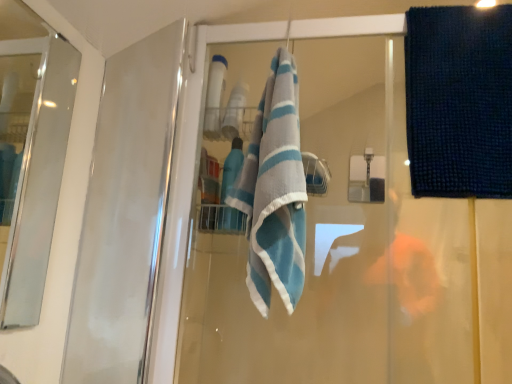
What do you see at coordinates (459, 101) in the screenshot? Image resolution: width=512 pixels, height=384 pixels. I see `dark blue textured towel at upper right` at bounding box center [459, 101].

This screenshot has height=384, width=512. Describe the element at coordinates (35, 164) in the screenshot. I see `clear glass screen door at left` at that location.

Where is `blue striped towel at center`? The width and height of the screenshot is (512, 384). blue striped towel at center is located at coordinates (275, 191).

What's the angular difference between blue striped towel at center and clear glass screen door at left's facing directions?

blue striped towel at center and clear glass screen door at left are facing 90.4 degrees away from each other.

Considering the positions of objects blue striped towel at center and clear glass screen door at left in the image provided, who is more to the right, blue striped towel at center or clear glass screen door at left?

blue striped towel at center is more to the right.

Based on the photo, is blue striped towel at center shorter than clear glass screen door at left?

Correct, blue striped towel at center is not as tall as clear glass screen door at left.

Between blue striped towel at center and dark blue textured towel at upper right, which one has smaller size?

dark blue textured towel at upper right.

Which object is positioned more to the right, blue striped towel at center or dark blue textured towel at upper right?

dark blue textured towel at upper right.

Can dark blue textured towel at upper right be found inside blue striped towel at center?

No, blue striped towel at center does not contain dark blue textured towel at upper right.

Considering the relative sizes of clear glass screen door at left and dark blue textured towel at upper right in the image provided, is clear glass screen door at left wider than dark blue textured towel at upper right?

In fact, clear glass screen door at left might be narrower than dark blue textured towel at upper right.

From a real-world perspective, which object rests below the other?

clear glass screen door at left.

How different are the orientations of clear glass screen door at left and dark blue textured towel at upper right in degrees?

90.4 degrees separate the facing orientations of clear glass screen door at left and dark blue textured towel at upper right.

Between point (42, 272) and point (455, 89), which one is positioned behind?

Positioned behind is point (42, 272).

From a real-world perspective, between dark blue textured towel at upper right and clear glass screen door at left, who is vertically lower?

In real-world perspective, clear glass screen door at left is lower.

Is dark blue textured towel at upper right facing towards clear glass screen door at left?

No, dark blue textured towel at upper right is not facing towards clear glass screen door at left.

Is dark blue textured towel at upper right spatially inside clear glass screen door at left, or outside of it?

dark blue textured towel at upper right is outside clear glass screen door at left.

Considering the positions of objects dark blue textured towel at upper right and clear glass screen door at left in the image provided, who is in front, dark blue textured towel at upper right or clear glass screen door at left?

clear glass screen door at left is closer to the camera.

Can you confirm if dark blue textured towel at upper right is thinner than blue striped towel at center?

Yes, dark blue textured towel at upper right is thinner than blue striped towel at center.

Is dark blue textured towel at upper right behind blue striped towel at center?

Yes, dark blue textured towel at upper right is behind blue striped towel at center.

Is dark blue textured towel at upper right oriented towards blue striped towel at center?

No.

Can you tell me how much clear glass screen door at left and blue striped towel at center differ in facing direction?

clear glass screen door at left and blue striped towel at center are facing 90.4 degrees away from each other.

Is blue striped towel at center at the back of clear glass screen door at left?

No, clear glass screen door at left is not facing the opposite direction of blue striped towel at center.

Would you say clear glass screen door at left is inside or outside blue striped towel at center?

clear glass screen door at left cannot be found inside blue striped towel at center.

From a real-world perspective, is clear glass screen door at left on blue striped towel at center?

Actually, clear glass screen door at left is physically below blue striped towel at center in the real world.

I want to click on towel on the right of clear glass screen door at left, so click(275, 191).

The height and width of the screenshot is (384, 512). Find the location of `towel on the left of the dark blue textured towel at upper right`. towel on the left of the dark blue textured towel at upper right is located at coordinates (275, 191).

From the image, which object appears to be nearer to clear glass screen door at left, dark blue textured towel at upper right or blue striped towel at center?

blue striped towel at center.

Considering their positions, is dark blue textured towel at upper right positioned further to blue striped towel at center than clear glass screen door at left?

Among the two, clear glass screen door at left is located further to blue striped towel at center.

Which object lies further to the anchor point dark blue textured towel at upper right, clear glass screen door at left or blue striped towel at center?

clear glass screen door at left is further to dark blue textured towel at upper right.

When comparing their distances from clear glass screen door at left, does blue striped towel at center or dark blue textured towel at upper right seem closer?

Based on the image, blue striped towel at center appears to be nearer to clear glass screen door at left.

Estimate the real-world distances between objects in this image. Which object is further from dark blue textured towel at upper right, blue striped towel at center or clear glass screen door at left?

The object further to dark blue textured towel at upper right is clear glass screen door at left.

When comparing their distances from blue striped towel at center, does clear glass screen door at left or dark blue textured towel at upper right seem closer?

Among the two, dark blue textured towel at upper right is located nearer to blue striped towel at center.

Locate an element on the screen. towel located between clear glass screen door at left and dark blue textured towel at upper right in the left-right direction is located at coordinates (275, 191).